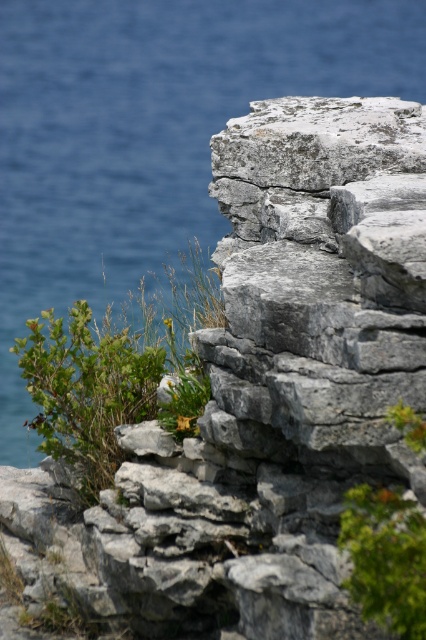
You are standing at the edge of the rocky outcrop looking towards the water. There are two points marked on the rocks. Which point is closer to you, point (175, 250) or point (75, 358)?

Point (175, 250) is closer to you because it is further to the viewer than point (75, 358).

Looking at this image, you are standing at the edge of the rocky outcrop near the water. You see a point marked at coordinates (115, 371). What object is located at this point?

The point at coordinates (115, 371) corresponds to the green leafy bush at center left.